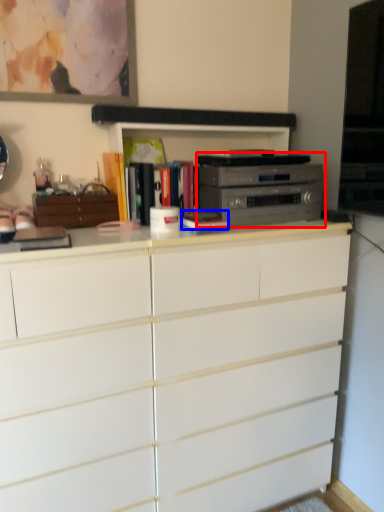
Question: Which point is further to the camera, home appliance (highlighted by a red box) or book (highlighted by a blue box)?

Choices:
 (A) home appliance
 (B) book

Answer: (A)